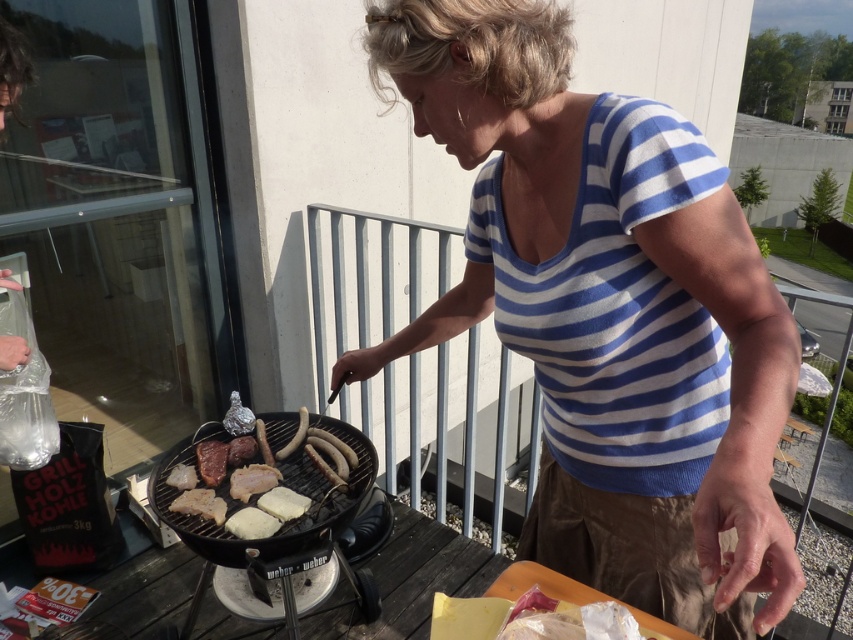
You are setting up a picnic and need to place the black matte barbecue grill at center and the white matte bread at center on a table. Based on the image, which object should be placed to the left side of the table?

The black matte barbecue grill at center should be placed to the left side of the table because it is positioned to the left of the white matte bread at center in the image.

What is located at the coordinates point (271,486) in the image?

The point (271,486) indicates grilled meat and sausages at center.

You are standing at the point with coordinates point (244,484) and want to move towards the grill. Is the grill located in front of or behind the point (328,499)?

The grill is located in front of the point (328,499) because point (328,499) is in front of point (244,484).